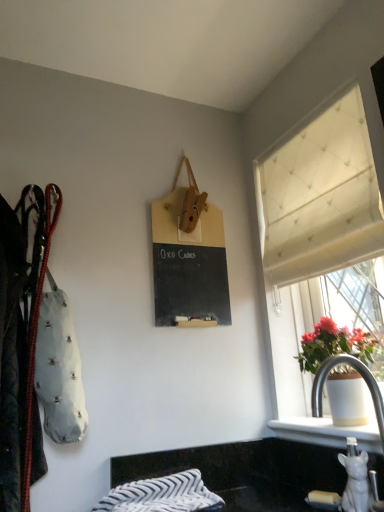
Question: From the image's perspective, does striped cotton blanket at lower center appear higher than leather coat at left?

Choices:
 (A) yes
 (B) no

Answer: (B)

Question: Could leather coat at left be considered to be inside striped cotton blanket at lower center?

Choices:
 (A) yes
 (B) no

Answer: (B)

Question: Is striped cotton blanket at lower center positioned with its back to leather coat at left?

Choices:
 (A) no
 (B) yes

Answer: (A)

Question: Is striped cotton blanket at lower center shorter than leather coat at left?

Choices:
 (A) no
 (B) yes

Answer: (B)

Question: Is striped cotton blanket at lower center thinner than leather coat at left?

Choices:
 (A) no
 (B) yes

Answer: (A)

Question: Does point (241, 443) appear closer or farther from the camera than point (23, 478)?

Choices:
 (A) farther
 (B) closer

Answer: (A)

Question: In the image, is black granite countertop at lower center positioned in front of or behind leather coat at left?

Choices:
 (A) behind
 (B) front

Answer: (A)

Question: Is black granite countertop at lower center taller or shorter than leather coat at left?

Choices:
 (A) short
 (B) tall

Answer: (A)

Question: Choose the correct answer: Is black granite countertop at lower center inside leather coat at left or outside it?

Choices:
 (A) inside
 (B) outside

Answer: (B)

Question: From a real-world perspective, relative to striped cotton blanket at lower center, is white textured curtain at upper right vertically above or below?

Choices:
 (A) above
 (B) below

Answer: (A)

Question: From the image's perspective, is white textured curtain at upper right located above or below striped cotton blanket at lower center?

Choices:
 (A) above
 (B) below

Answer: (A)

Question: Considering the relative positions of white textured curtain at upper right and striped cotton blanket at lower center in the image provided, is white textured curtain at upper right to the left or to the right of striped cotton blanket at lower center?

Choices:
 (A) left
 (B) right

Answer: (B)

Question: Is white textured curtain at upper right bigger or smaller than striped cotton blanket at lower center?

Choices:
 (A) small
 (B) big

Answer: (B)

Question: Does point [347, 486] appear closer or farther from the camera than point [312, 474]?

Choices:
 (A) farther
 (B) closer

Answer: (B)

Question: Is white glossy sink at lower right in front of or behind black granite countertop at lower center in the image?

Choices:
 (A) behind
 (B) front

Answer: (B)